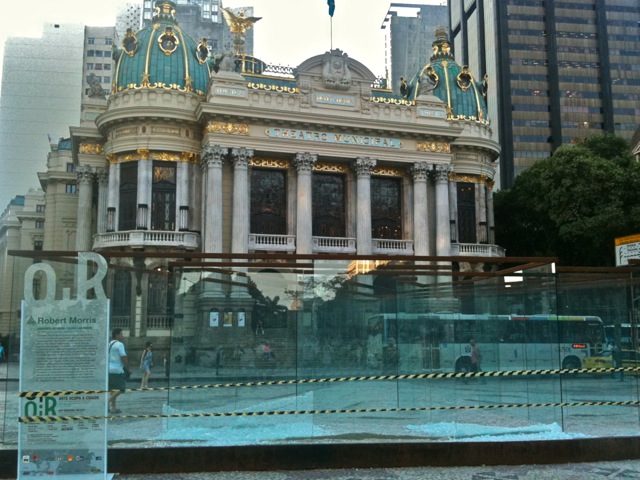
Where is `2nd floor railing`? The height and width of the screenshot is (480, 640). 2nd floor railing is located at coordinates (283, 240).